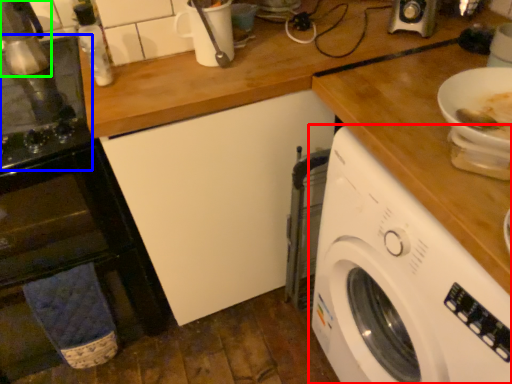
Question: Estimate the real-world distances between objects in this image. Which object is closer to washing machine (highlighted by a red box), appliance (highlighted by a blue box) or appliance (highlighted by a green box)?

Choices:
 (A) appliance
 (B) appliance

Answer: (A)